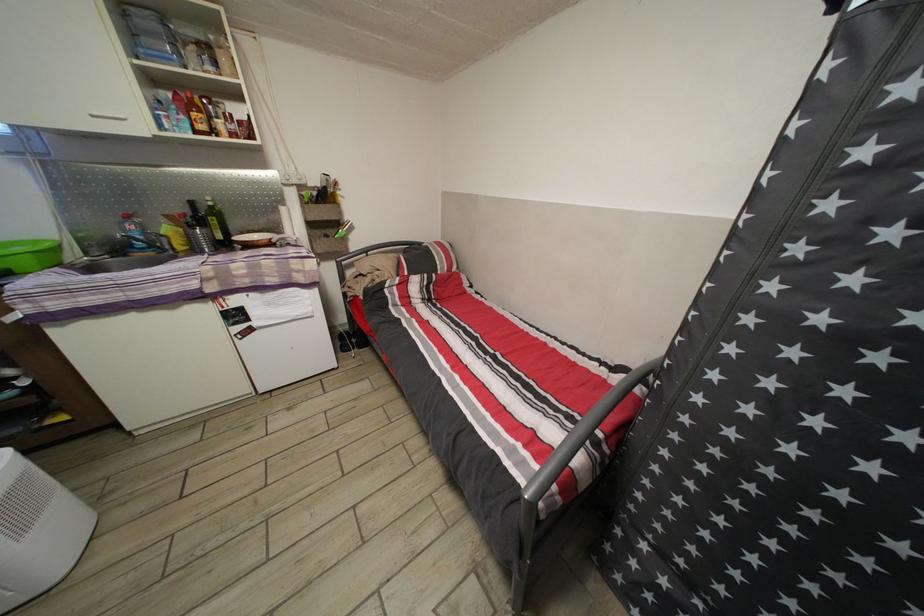
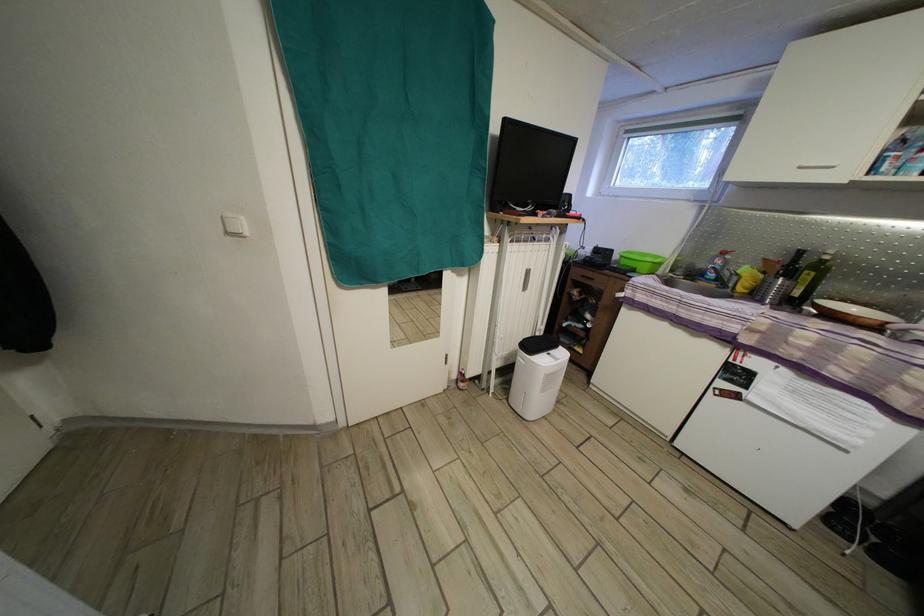
The first image is from the beginning of the video and the second image is from the end. How did the camera likely rotate when shooting the video?

The camera rotated toward left-down.